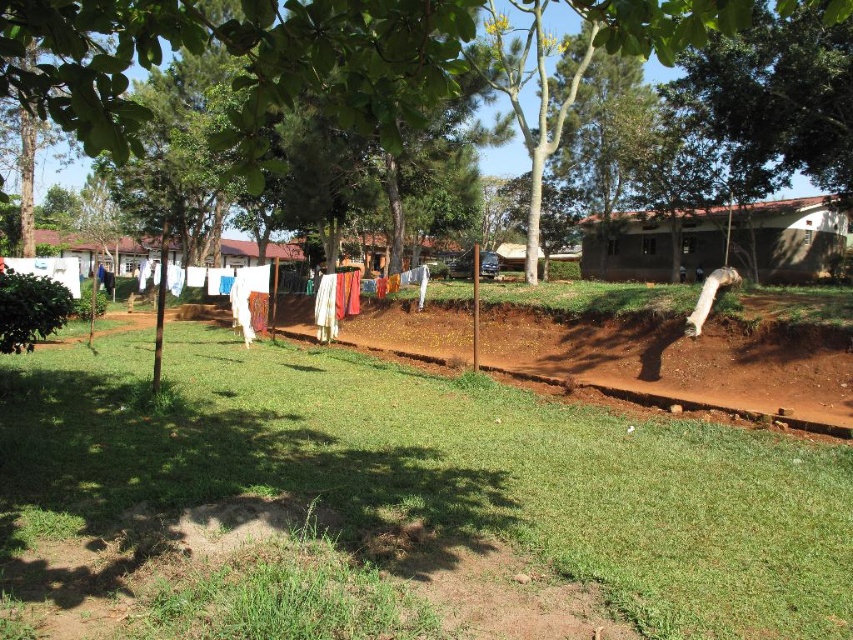
Question: In this image, where is green grass at center located relative to green leafy tree at center?

Choices:
 (A) below
 (B) above

Answer: (A)

Question: Which object appears closest to the camera in this image?

Choices:
 (A) green leafy tree at center
 (B) green grass at center

Answer: (A)

Question: Does green grass at center appear over green leafy tree at center?

Choices:
 (A) yes
 (B) no

Answer: (B)

Question: Does green grass at center have a greater width compared to green leafy tree at center?

Choices:
 (A) yes
 (B) no

Answer: (B)